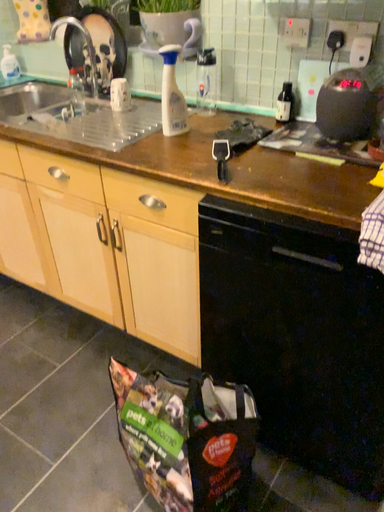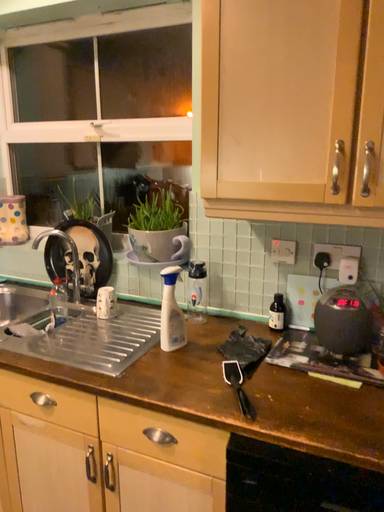
Question: How did the camera likely rotate when shooting the video?

Choices:
 (A) rotated downward
 (B) rotated upward

Answer: (B)